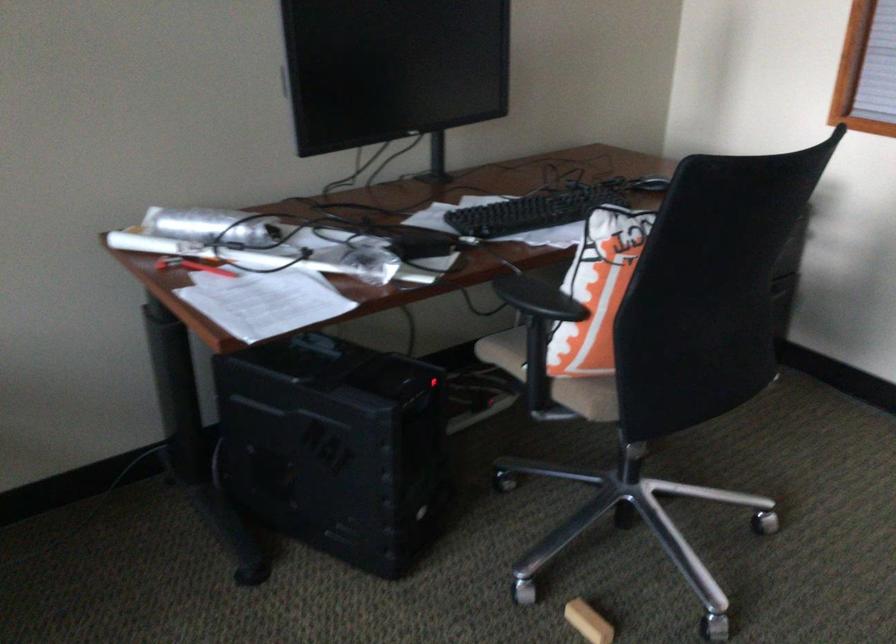
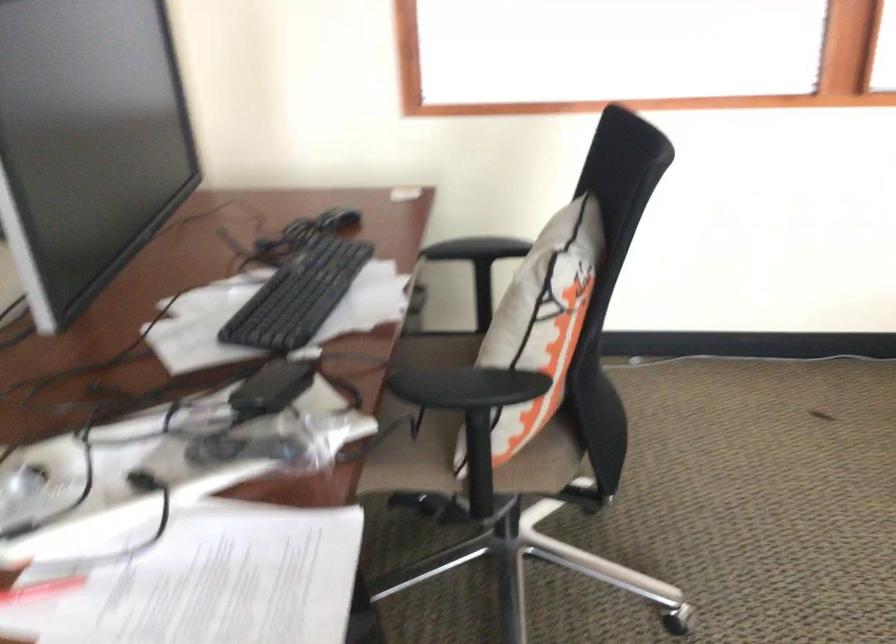
Question: Based on the continuous images, in which direction is the camera rotating? Reply with the corresponding letter.

Choices:
 (A) Left
 (B) Right
 (C) Up
 (D) Down

Answer: (B)